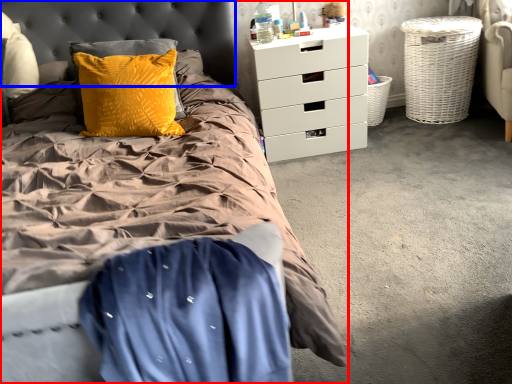
Question: Among these objects, which one is farthest to the camera, bed (highlighted by a red box) or headboard (highlighted by a blue box)?

Choices:
 (A) bed
 (B) headboard

Answer: (B)